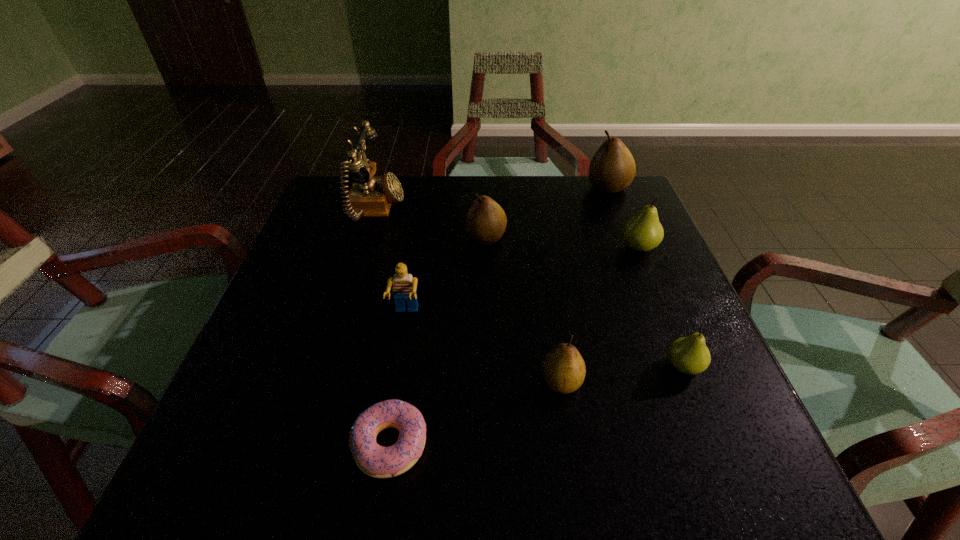
Image resolution: width=960 pixels, height=540 pixels. Identify the location of free space at the right edge of the desktop. (644, 421).

The height and width of the screenshot is (540, 960). What are the coordinates of `vacant region at the far left corner of the desktop` in the screenshot? It's located at (337, 196).

Identify the location of vacant space at the near left corner. (261, 482).

At what (x,y) coordinates should I click in order to perform the action: click on vacant point at the near right corner. Please return your answer as a coordinate pair (x, y). The width and height of the screenshot is (960, 540). Looking at the image, I should click on (751, 454).

Locate an element on the screen. This screenshot has height=540, width=960. unoccupied position between the farthest brown pear and the Lego is located at coordinates (507, 251).

Find the location of `vacant point located between the pink doughnut and the farthest brown pear`. vacant point located between the pink doughnut and the farthest brown pear is located at coordinates (499, 315).

You are a GUI agent. You are given a task and a screenshot of the screen. Output one action in this format:
    pyautogui.click(x=<x>, y=<y>)
    Task: Click on the empty location between the telephone and the second tallest object
    
    Given the screenshot: What is the action you would take?
    pyautogui.click(x=492, y=199)

At what (x,y) coordinates should I click in order to perform the action: click on free space between the pink doughnut and the farther green pear. Please return your answer as a coordinate pair (x, y). This screenshot has width=960, height=540. Looking at the image, I should click on pos(515,346).

The image size is (960, 540). Find the location of `free spot between the farther green pear and the blue Lego`. free spot between the farther green pear and the blue Lego is located at coordinates (522, 281).

Where is `empty location between the bigger green pear and the nearest object`? empty location between the bigger green pear and the nearest object is located at coordinates (515, 346).